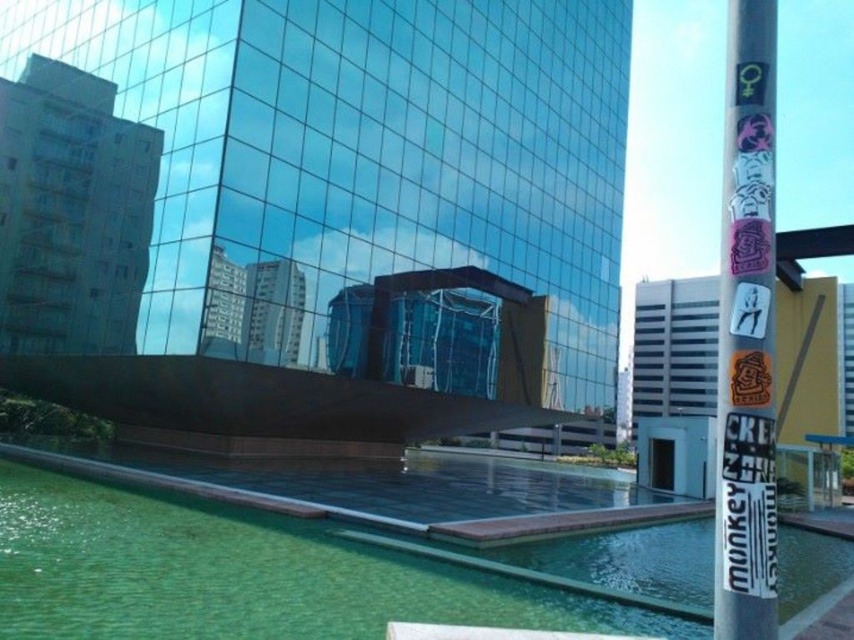
You are standing in the urban landscape and want to place a decorative statue between the green glass pool at center and the silver metallic pole at right. Based on their positions, which object should the statue be closer to?

The statue should be placed closer to the silver metallic pole at right since the green glass pool at center is located to the left of the silver metallic pole at right.